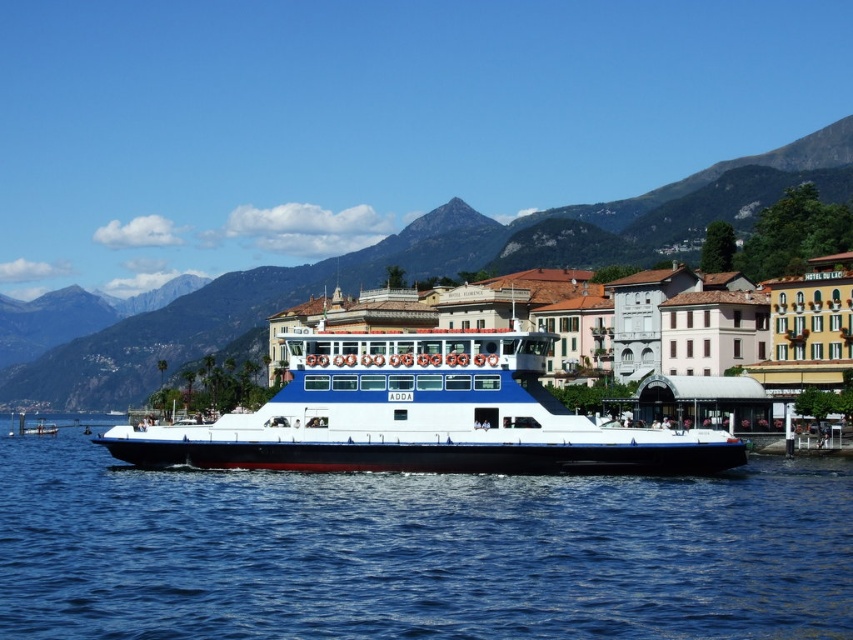
Where is `blue glossy water at center`? blue glossy water at center is located at coordinates (416, 552).

Can you confirm if blue glossy water at center is thinner than white matte cruise ship at center?

No, blue glossy water at center is not thinner than white matte cruise ship at center.

The width and height of the screenshot is (853, 640). What do you see at coordinates (416, 552) in the screenshot?
I see `blue glossy water at center` at bounding box center [416, 552].

At what (x,y) coordinates should I click in order to perform the action: click on blue glossy water at center. Please return your answer as a coordinate pair (x, y). Image resolution: width=853 pixels, height=640 pixels. Looking at the image, I should click on (416, 552).

Who is shorter, blue glossy water at center or rugged stone mountain at center?

blue glossy water at center

Who is taller, blue glossy water at center or rugged stone mountain at center?

Standing taller between the two is rugged stone mountain at center.

Where is `blue glossy water at center`? Image resolution: width=853 pixels, height=640 pixels. blue glossy water at center is located at coordinates (416, 552).

The height and width of the screenshot is (640, 853). Find the location of `blue glossy water at center`. blue glossy water at center is located at coordinates (416, 552).

Does point (451, 419) come behind point (252, 292)?

That is False.

Does white matte cruise ship at center have a lesser width compared to rugged stone mountain at center?

Yes, white matte cruise ship at center is thinner than rugged stone mountain at center.

Which is behind, point (257, 435) or point (418, 250)?

Point (418, 250)

Find the location of a particular element. Image resolution: width=853 pixels, height=640 pixels. white matte cruise ship at center is located at coordinates (421, 413).